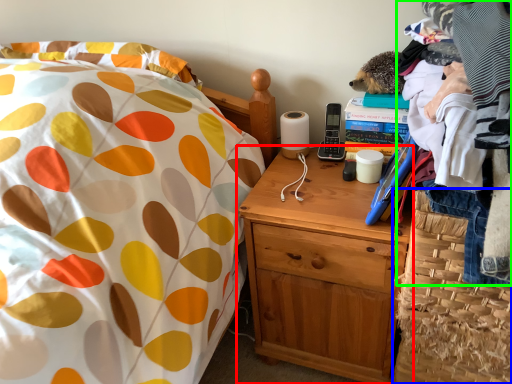
Question: Considering the real-world distances, which object is closest to nightstand (highlighted by a red box)? basket (highlighted by a blue box) or clothing (highlighted by a green box).

Choices:
 (A) basket
 (B) clothing

Answer: (A)